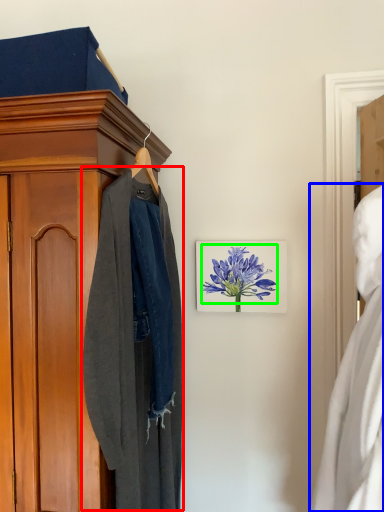
Question: Based on their relative distances, which object is farther from clothing (highlighted by a red box)? Choose from dress (highlighted by a blue box) and flower (highlighted by a green box).

Choices:
 (A) dress
 (B) flower

Answer: (A)